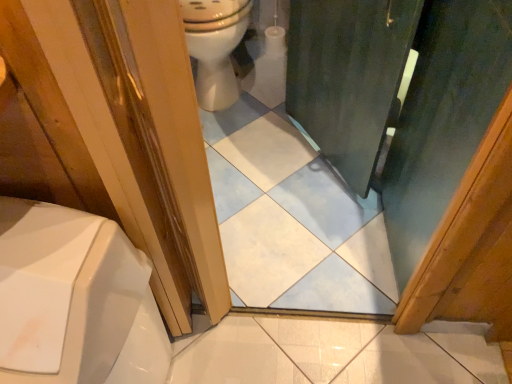
Question: Considering their positions, is green matte screen door at center located in front of or behind white glossy toilet at upper center?

Choices:
 (A) behind
 (B) front

Answer: (B)

Question: Considering the positions of point (416, 195) and point (207, 36), is point (416, 195) closer or farther from the camera than point (207, 36)?

Choices:
 (A) farther
 (B) closer

Answer: (B)

Question: Is green matte screen door at center taller or shorter than white glossy toilet at upper center?

Choices:
 (A) short
 (B) tall

Answer: (B)

Question: In terms of size, does white glossy toilet at upper center appear bigger or smaller than green matte screen door at center?

Choices:
 (A) small
 (B) big

Answer: (A)

Question: Is white glossy toilet at upper center in front of or behind green matte screen door at center in the image?

Choices:
 (A) behind
 (B) front

Answer: (A)

Question: In terms of height, does white glossy toilet at upper center look taller or shorter compared to green matte screen door at center?

Choices:
 (A) short
 (B) tall

Answer: (A)

Question: From a real-world perspective, is white glossy toilet at upper center positioned above or below green matte screen door at center?

Choices:
 (A) below
 (B) above

Answer: (A)